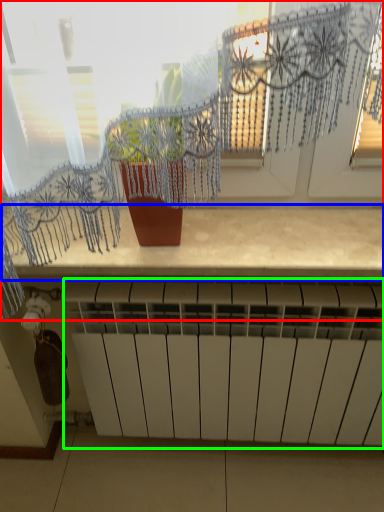
Question: Which is nearer to the window (highlighted by a red box)? counter top (highlighted by a blue box) or radiator (highlighted by a green box).

Choices:
 (A) counter top
 (B) radiator

Answer: (A)